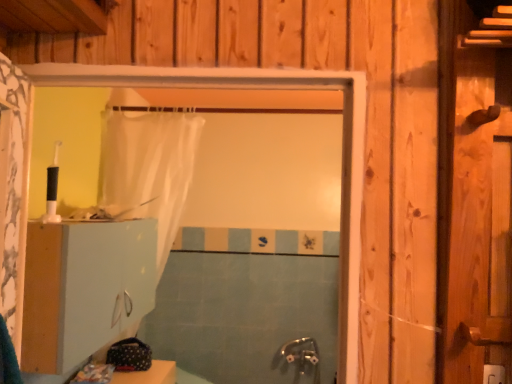
Question: Would you say white matte cabinet at lower left is part of blue tile bath at center's contents?

Choices:
 (A) no
 (B) yes

Answer: (A)

Question: From a real-world perspective, is blue tile bath at center physically above white matte cabinet at lower left?

Choices:
 (A) no
 (B) yes

Answer: (A)

Question: From a real-world perspective, is blue tile bath at center beneath white matte cabinet at lower left?

Choices:
 (A) no
 (B) yes

Answer: (B)

Question: Is blue tile bath at center not near white matte cabinet at lower left?

Choices:
 (A) no
 (B) yes

Answer: (B)

Question: Does blue tile bath at center have a smaller size compared to white matte cabinet at lower left?

Choices:
 (A) no
 (B) yes

Answer: (B)

Question: From the image's perspective, is blue tile bath at center beneath white matte cabinet at lower left?

Choices:
 (A) yes
 (B) no

Answer: (A)

Question: Considering the relative sizes of blue tile bath at center and translucent white shower curtain at center in the image provided, is blue tile bath at center bigger than translucent white shower curtain at center?

Choices:
 (A) no
 (B) yes

Answer: (A)

Question: Is blue tile bath at center at the right side of translucent white shower curtain at center?

Choices:
 (A) no
 (B) yes

Answer: (B)

Question: From a real-world perspective, is blue tile bath at center below translucent white shower curtain at center?

Choices:
 (A) no
 (B) yes

Answer: (B)

Question: Does blue tile bath at center have a lesser width compared to translucent white shower curtain at center?

Choices:
 (A) no
 (B) yes

Answer: (B)

Question: Does blue tile bath at center have a greater height compared to translucent white shower curtain at center?

Choices:
 (A) yes
 (B) no

Answer: (B)

Question: Does blue tile bath at center have a lesser height compared to translucent white shower curtain at center?

Choices:
 (A) no
 (B) yes

Answer: (B)

Question: Considering the relative sizes of translucent white shower curtain at center and white matte cabinet at lower left in the image provided, is translucent white shower curtain at center wider than white matte cabinet at lower left?

Choices:
 (A) yes
 (B) no

Answer: (A)